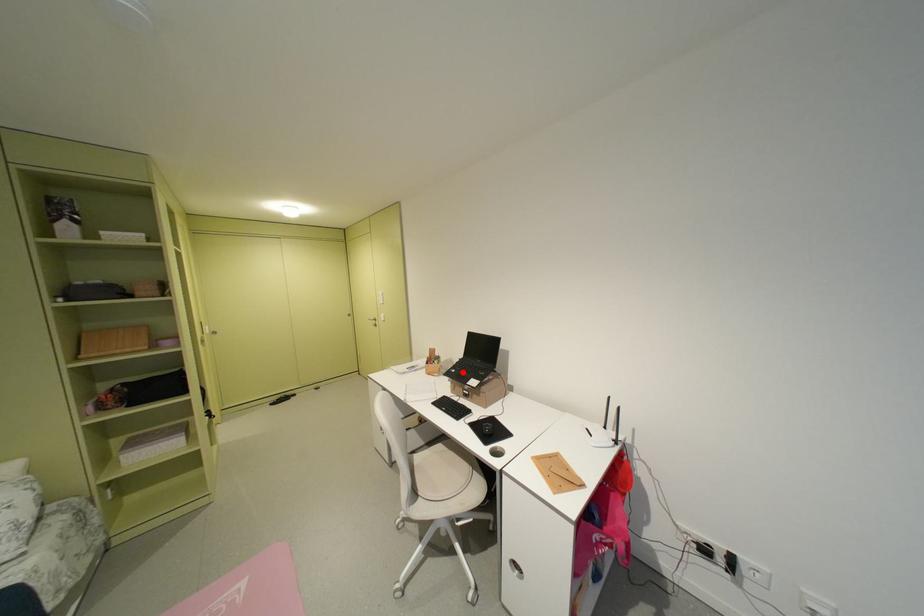
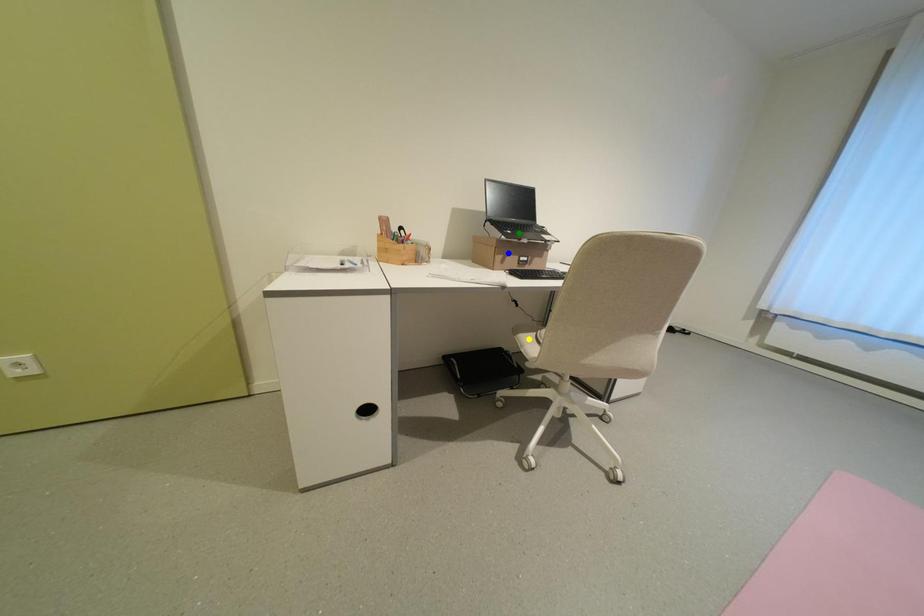
Question: I am providing you with two images of the same scene from different viewpoints. A red point is marked on the first image. You are given multiple points on the second image. Which mark in image 2 goes with the point in image 1?

Choices:
 (A) yellow point
 (B) blue point
 (C) green point

Answer: (C)